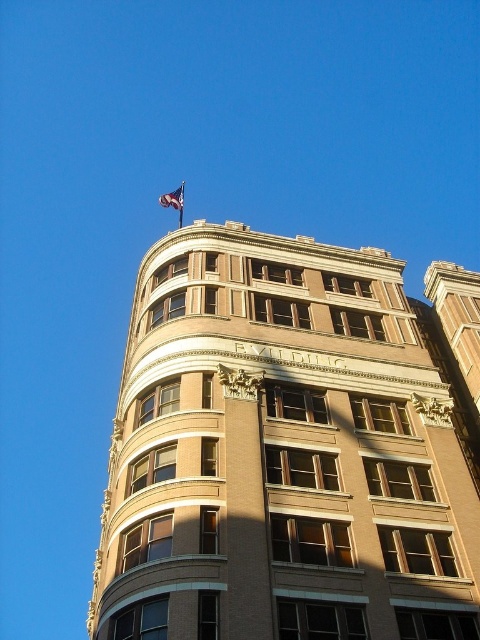
You are an architect reviewing the building design. The blue fabric flag at upper center and the metallic flag pole at upper center are part of the proposed design. Which object is shorter in height?

The blue fabric flag at upper center is not as tall as the metallic flag pole at upper center, so the blue fabric flag at upper center is shorter in height.

You are standing on the ground floor of the brown brick building at upper center and want to reach the metallic flag pole at upper center. Which direction should you go to move towards it?

The metallic flag pole at upper center is above the brown brick building at upper center, so you should go upwards to reach it.